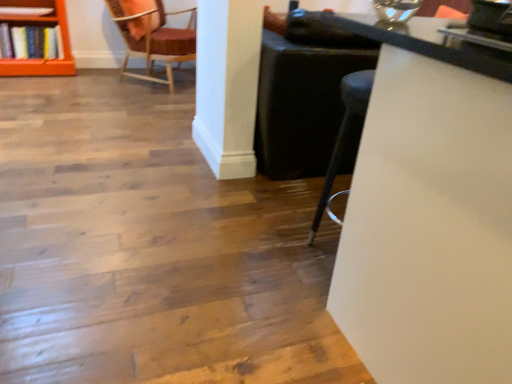
Question: Is white glossy table at upper right at the left side of velvet-like burgundy chair at upper left?

Choices:
 (A) yes
 (B) no

Answer: (B)

Question: Is white glossy table at upper right not within velvet-like burgundy chair at upper left?

Choices:
 (A) yes
 (B) no

Answer: (A)

Question: Is white glossy table at upper right far from velvet-like burgundy chair at upper left?

Choices:
 (A) yes
 (B) no

Answer: (A)

Question: Does white glossy table at upper right contain velvet-like burgundy chair at upper left?

Choices:
 (A) yes
 (B) no

Answer: (B)

Question: Can you confirm if white glossy table at upper right is shorter than velvet-like burgundy chair at upper left?

Choices:
 (A) yes
 (B) no

Answer: (B)

Question: Is white glossy table at upper right further to camera compared to velvet-like burgundy chair at upper left?

Choices:
 (A) no
 (B) yes

Answer: (A)

Question: Considering the relative sizes of orange wood shelf at upper left and white glossy table at upper right in the image provided, is orange wood shelf at upper left thinner than white glossy table at upper right?

Choices:
 (A) no
 (B) yes

Answer: (B)

Question: Can you confirm if orange wood shelf at upper left is shorter than white glossy table at upper right?

Choices:
 (A) yes
 (B) no

Answer: (A)

Question: Does orange wood shelf at upper left appear on the right side of white glossy table at upper right?

Choices:
 (A) no
 (B) yes

Answer: (A)

Question: Can you confirm if orange wood shelf at upper left is smaller than white glossy table at upper right?

Choices:
 (A) yes
 (B) no

Answer: (A)

Question: From the image's perspective, is orange wood shelf at upper left on white glossy table at upper right?

Choices:
 (A) yes
 (B) no

Answer: (A)

Question: Are orange wood shelf at upper left and white glossy table at upper right making contact?

Choices:
 (A) yes
 (B) no

Answer: (B)

Question: Can you confirm if white glossy table at upper right is bigger than orange wood shelf at upper left?

Choices:
 (A) no
 (B) yes

Answer: (B)